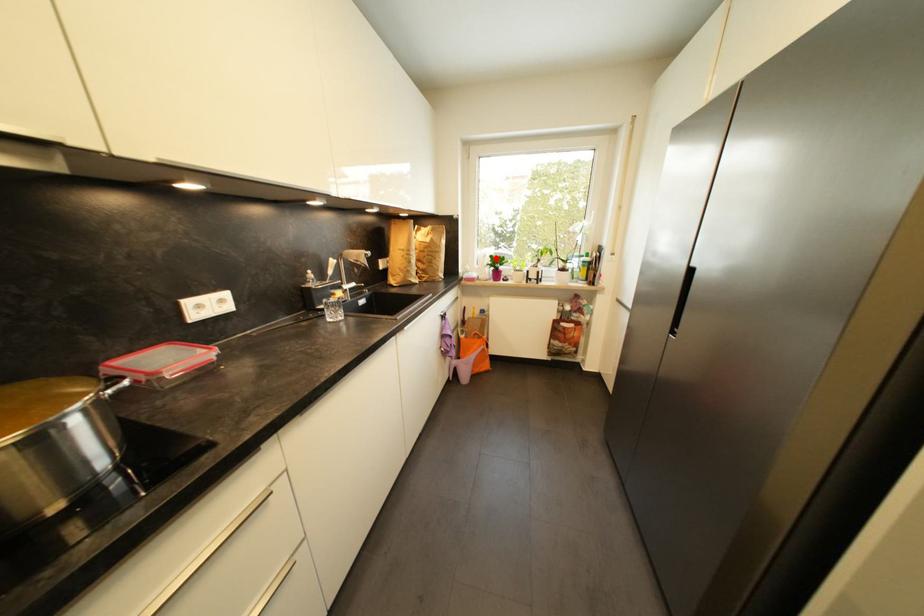
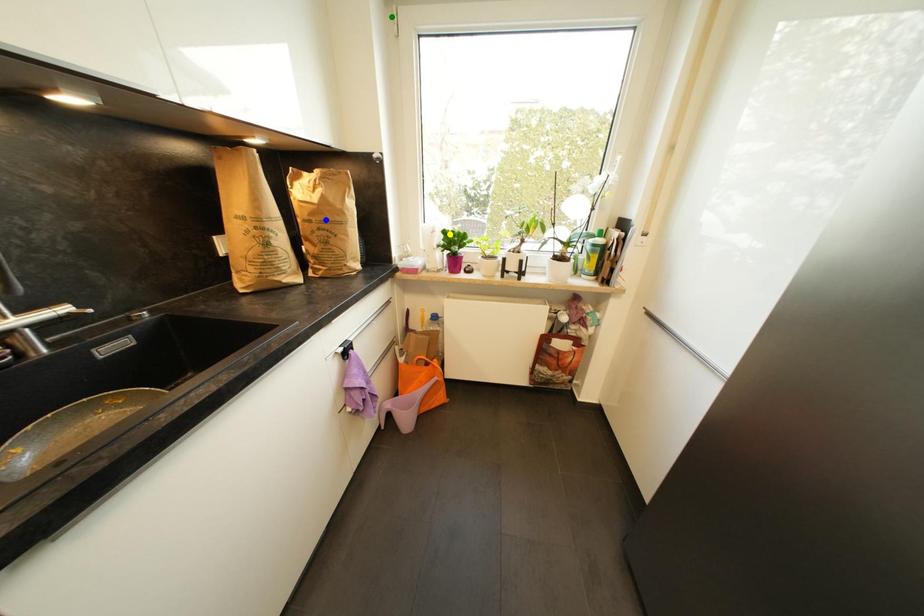
Question: I am providing you with two images of the same scene from different viewpoints. A red point is marked on the first image. You are given multiple points on the second image. Can you choose the point in image 2 that corresponds to the point in image 1?

Choices:
 (A) yellow point
 (B) blue point
 (C) green point

Answer: (A)